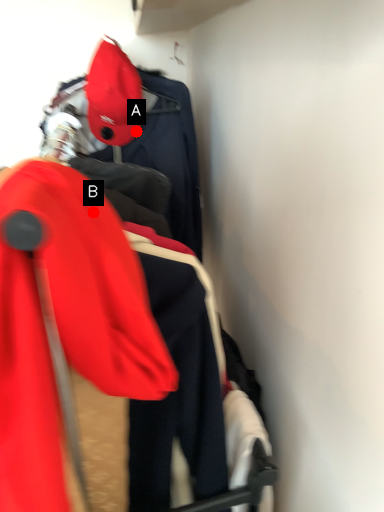
Question: Two points are circled on the image, labeled by A and B beside each circle. Which point is closer to the camera?

Choices:
 (A) A is closer
 (B) B is closer

Answer: (B)